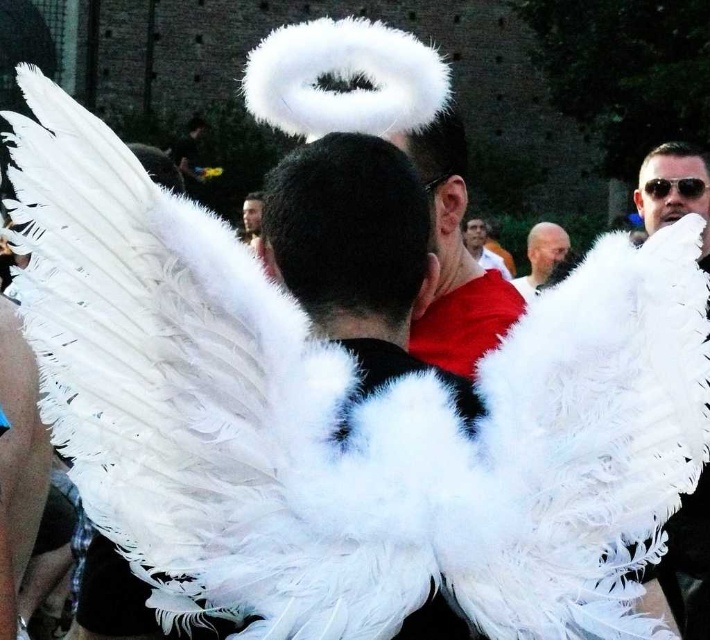
Question: Can you confirm if white fluffy wings at center is bigger than smooth white wings at center?

Choices:
 (A) no
 (B) yes

Answer: (B)

Question: Which point is farther to the camera?

Choices:
 (A) smooth white wings at center
 (B) white fluffy wings at center
 (C) sunglasses at upper right

Answer: (A)

Question: Can you confirm if white fluffy wings at center is positioned to the left of white feathered wings at upper center?

Choices:
 (A) no
 (B) yes

Answer: (B)

Question: Which is nearer to the sunglasses at upper right?

Choices:
 (A) bald head at center
 (B) smooth skin face at center
 (C) smooth white wings at center

Answer: (A)

Question: Can you confirm if white fluffy wings at center is bigger than bald head at center?

Choices:
 (A) yes
 (B) no

Answer: (A)

Question: Which object is farther from the camera taking this photo?

Choices:
 (A) white fluffy wings at center
 (B) white feathered wings at upper center

Answer: (A)